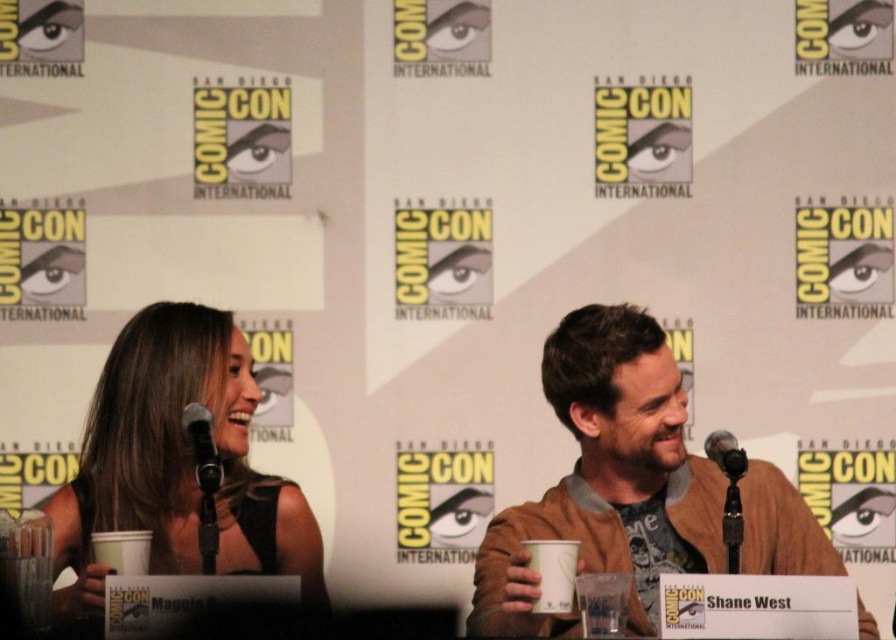
This screenshot has height=640, width=896. Describe the element at coordinates (607, 480) in the screenshot. I see `brown leather jacket at center` at that location.

Can you confirm if brown leather jacket at center is thinner than black metallic microphone at right?

Incorrect, brown leather jacket at center's width is not less than black metallic microphone at right's.

Where is `brown leather jacket at center`? The height and width of the screenshot is (640, 896). brown leather jacket at center is located at coordinates (607, 480).

Does brown leather jacket at center have a greater width compared to black metallic microphone at upper left?

Correct, the width of brown leather jacket at center exceeds that of black metallic microphone at upper left.

Between brown leather jacket at center and black metallic microphone at upper left, which one is positioned lower?

brown leather jacket at center is lower down.

Which is behind, point (625, 403) or point (208, 496)?

The point (625, 403) is more distant.

Where is `brown leather jacket at center`? The width and height of the screenshot is (896, 640). brown leather jacket at center is located at coordinates point(607,480).

What do you see at coordinates (202, 449) in the screenshot?
I see `black metallic microphone at upper left` at bounding box center [202, 449].

Is black metallic microphone at upper left closer to the viewer compared to black metallic microphone at right?

No, black metallic microphone at upper left is behind black metallic microphone at right.

The height and width of the screenshot is (640, 896). What do you see at coordinates (202, 449) in the screenshot? I see `black metallic microphone at upper left` at bounding box center [202, 449].

Find the location of a particular element. black metallic microphone at upper left is located at coordinates (202, 449).